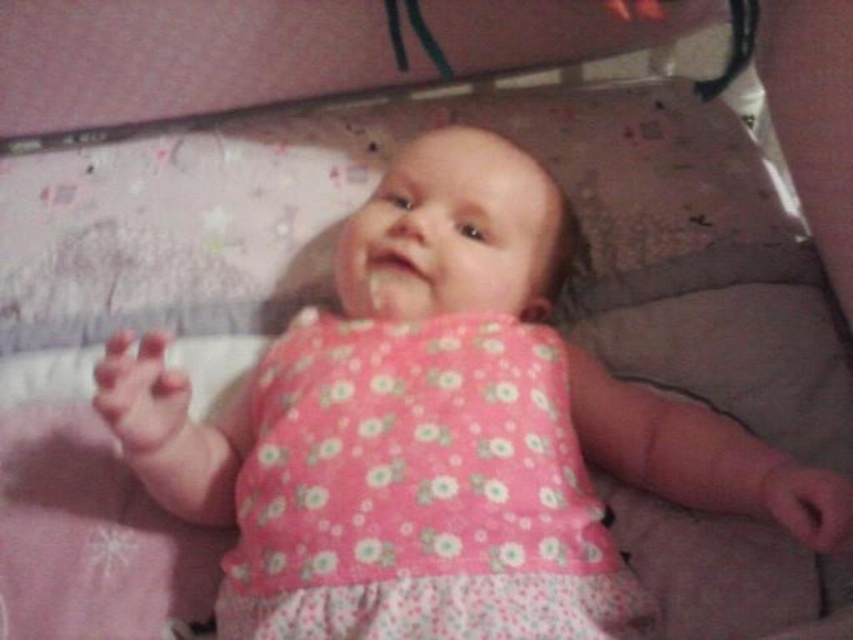
You are a photographer taking a picture of the baby in the crib. You want to focus on the pink floral dress at center and the pink floral fabric dress at center. Which one should you adjust your camera to the left to capture better?

To better capture the pink floral dress at center, you should adjust your camera to the left since it is positioned to the left of the pink floral fabric dress at center.

You are a photographer trying to capture a closeup of the baby in the crib. You notice the pink floral dress at center and the pink floral fabric dress at center. Are these two items close enough to each other to be in focus simultaneously if your camera has a depth of field that can handle 1.2 inches?

The distance between the pink floral dress at center and the pink floral fabric dress at center is 1.17 inches, which is within the camera depth of field of 1.2 inches. Therefore, both items can be in focus simultaneously.

You are a photographer taking a picture of the baby in the crib. You notice the pink floral dress at center and the pink floral fabric dress at center. Which one should you focus on to ensure it appears larger in the photo?

The pink floral dress at center is much taller than the pink floral fabric dress at center, so focusing on the pink floral dress at center will make it appear larger in the photo.